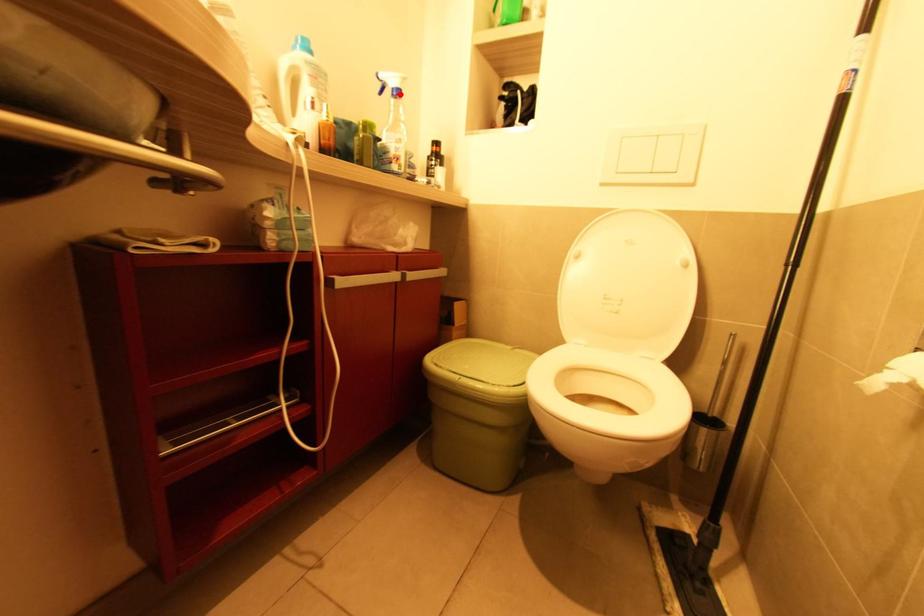
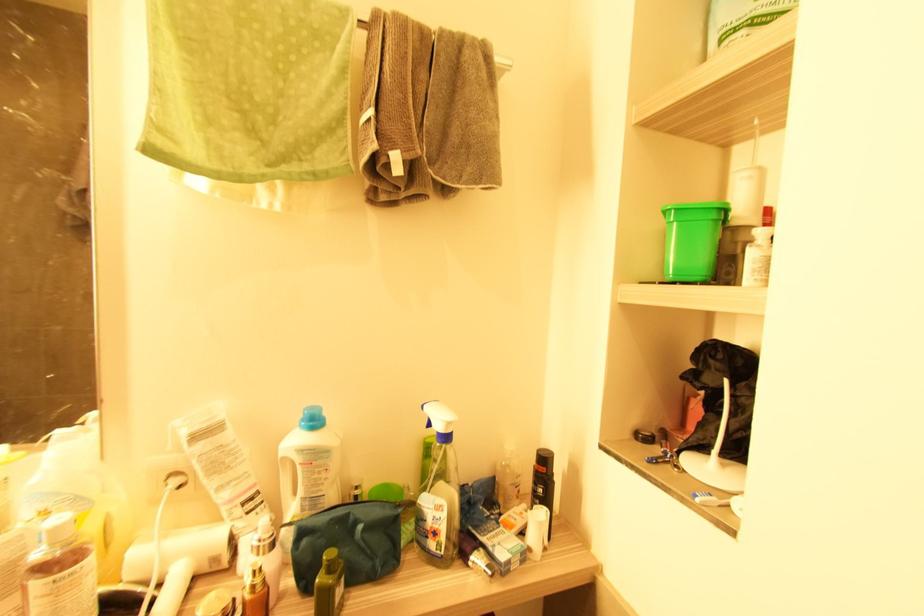
Where in the second image is the point corresponding to the highlighted location from the first image?

(447, 438)